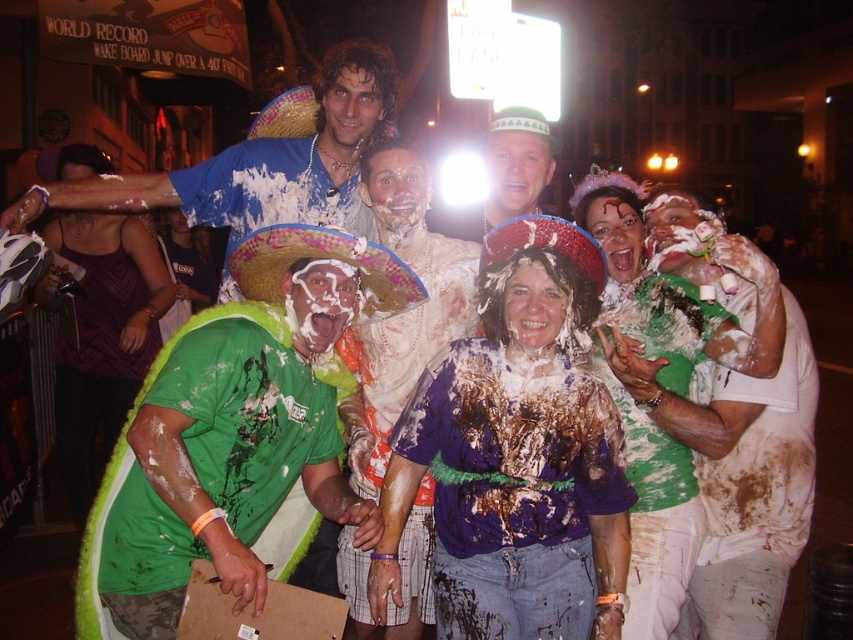
Is green fuzzy sombrero at left wider than multicolored straw sombrero at center?

Yes, green fuzzy sombrero at left is wider than multicolored straw sombrero at center.

Between green fuzzy sombrero at left and multicolored straw sombrero at center, which one appears on the right side from the viewer's perspective?

From the viewer's perspective, multicolored straw sombrero at center appears more on the right side.

Is point (287, 292) closer to viewer compared to point (303, 225)?

No, it is not.

Locate an element on the screen. This screenshot has height=640, width=853. green fuzzy sombrero at left is located at coordinates (236, 433).

In the scene shown: Between dirty purple shirt at center and green straw sombrero at center, which one appears on the left side from the viewer's perspective?

From the viewer's perspective, dirty purple shirt at center appears more on the left side.

Does dirty purple shirt at center come in front of green straw sombrero at center?

No.

Locate an element on the screen. This screenshot has height=640, width=853. dirty purple shirt at center is located at coordinates point(515,456).

Can you confirm if white painted shirt at center is shorter than white frosted cake at center?

Yes, white painted shirt at center is shorter than white frosted cake at center.

Does white painted shirt at center appear on the right side of white frosted cake at center?

Indeed, white painted shirt at center is positioned on the right side of white frosted cake at center.

What do you see at coordinates (744, 481) in the screenshot? I see `white painted shirt at center` at bounding box center [744, 481].

Identify the location of white painted shirt at center. Image resolution: width=853 pixels, height=640 pixels. (744, 481).